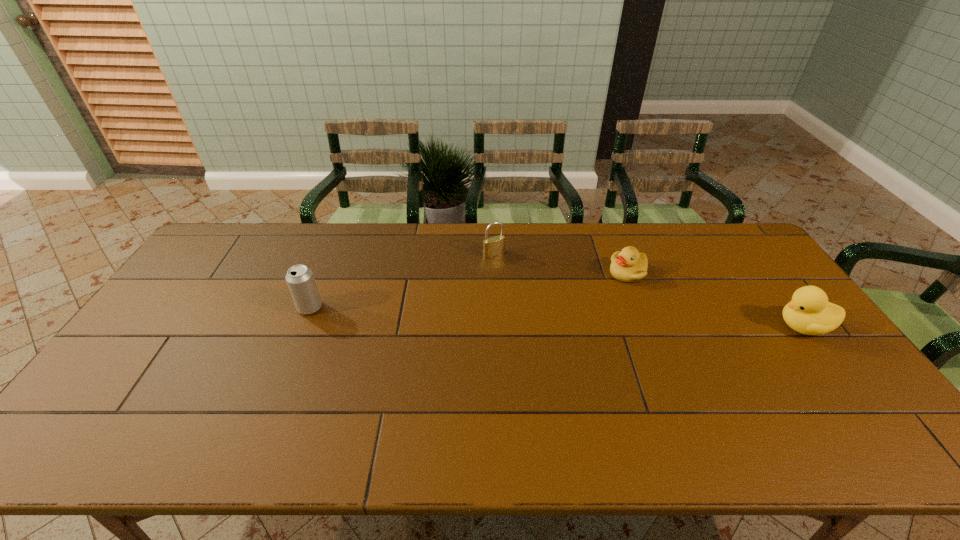
Find the location of a particular element. The width and height of the screenshot is (960, 540). beer can is located at coordinates (300, 279).

At what (x,y) coordinates should I click in order to perform the action: click on duck. Please return your answer as a coordinate pair (x, y). The image size is (960, 540). Looking at the image, I should click on (809, 312).

The image size is (960, 540). Identify the location of the second object from left to right. (493, 246).

The width and height of the screenshot is (960, 540). What are the coordinates of `padlock` in the screenshot? It's located at (493, 246).

The height and width of the screenshot is (540, 960). Find the location of `the third nearest object`. the third nearest object is located at coordinates (628, 265).

Locate an element on the screen. Image resolution: width=960 pixels, height=540 pixels. the second object from right to left is located at coordinates (628, 265).

Identify the location of vacant space located on the right of the leftmost object. The width and height of the screenshot is (960, 540). (385, 307).

The height and width of the screenshot is (540, 960). Identify the location of vacant region located 0.380m on the front-facing side of the rightmost object. (644, 327).

At what (x,y) coordinates should I click in order to perform the action: click on vacant space located on the front-facing side of the rightmost object. Please return your answer as a coordinate pair (x, y). Looking at the image, I should click on (758, 327).

Identify the location of vacant area situated 0.160m on the front-facing side of the rightmost object. This screenshot has width=960, height=540. (720, 327).